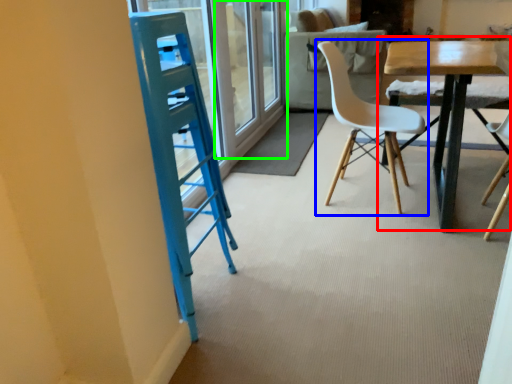
Question: Based on their relative distances, which object is nearer to table (highlighted by a red box)? Choose from chair (highlighted by a blue box) and screen door (highlighted by a green box).

Choices:
 (A) chair
 (B) screen door

Answer: (A)